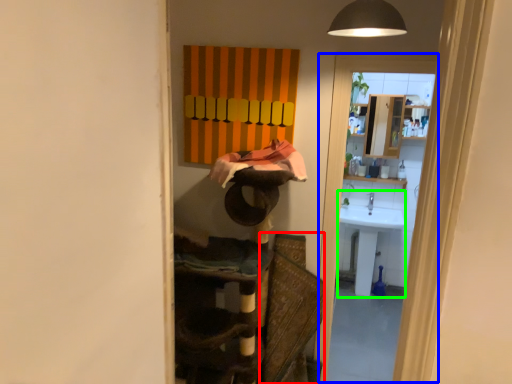
Question: Which object is positioned farthest from swivel chair (highlighted by a red box)? Select from screen door (highlighted by a blue box) and sink (highlighted by a green box).

Choices:
 (A) screen door
 (B) sink

Answer: (B)